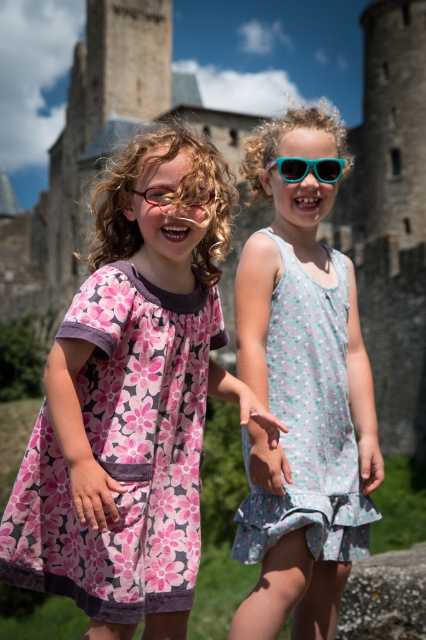
Question: Observing the image, what is the correct spatial positioning of pink floral fabric dress at left in reference to teal plastic sunglasses at upper right?

Choices:
 (A) above
 (B) below

Answer: (B)

Question: Estimate the real-world distances between objects in this image. Which object is closer to the stone castle at center?

Choices:
 (A) floral cotton dress at center
 (B) teal plastic sunglasses at upper right
 (C) pink floral fabric dress at left
 (D) matte red glasses at center

Answer: (A)

Question: Which of the following is the farthest from the observer?

Choices:
 (A) (396, 131)
 (B) (301, 164)
 (C) (164, 198)
 (D) (172, 496)

Answer: (A)

Question: Is stone castle at center to the left of matte red glasses at center from the viewer's perspective?

Choices:
 (A) yes
 (B) no

Answer: (A)

Question: Is stone castle at center bigger than pink floral fabric dress at left?

Choices:
 (A) yes
 (B) no

Answer: (A)

Question: Which object is positioned closest to the floral cotton dress at center?

Choices:
 (A) teal plastic sunglasses at upper right
 (B) matte red glasses at center
 (C) stone castle at center

Answer: (A)